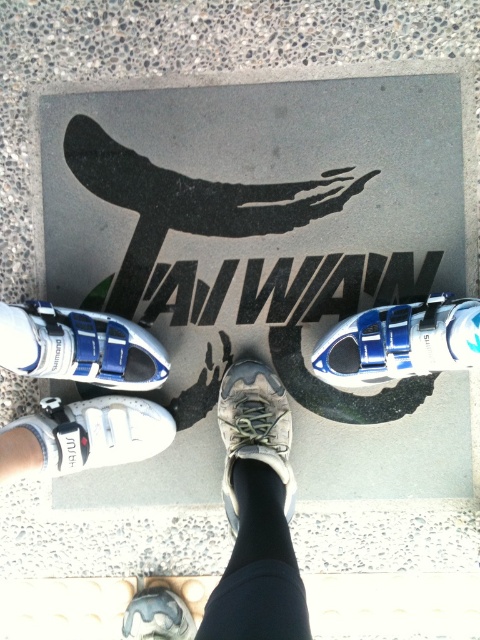
You are a photographer trying to capture the white synthetic shoe at left on the mat. The mat has a graphic with the word TAIWAN. Where should you position your camera to ensure the shoe is centered in the frame?

Position the camera at point (x=80, y=348) to center the white synthetic shoe at left in the frame.

You are a shoe designer evaluating the image. You need to determine which shoe is taller between the white synthetic shoe at left and the blue matte cycling shoe at center. Based on the scene, which one is taller?

The blue matte cycling shoe at center is taller than the white synthetic shoe at left.